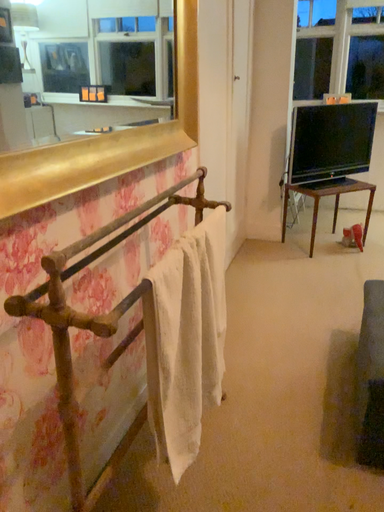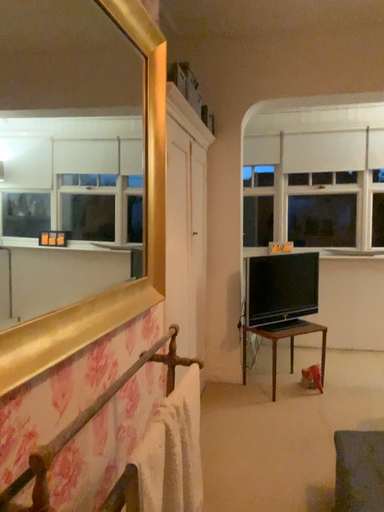
Question: How did the camera likely rotate when shooting the video?

Choices:
 (A) rotated downward
 (B) rotated upward

Answer: (B)